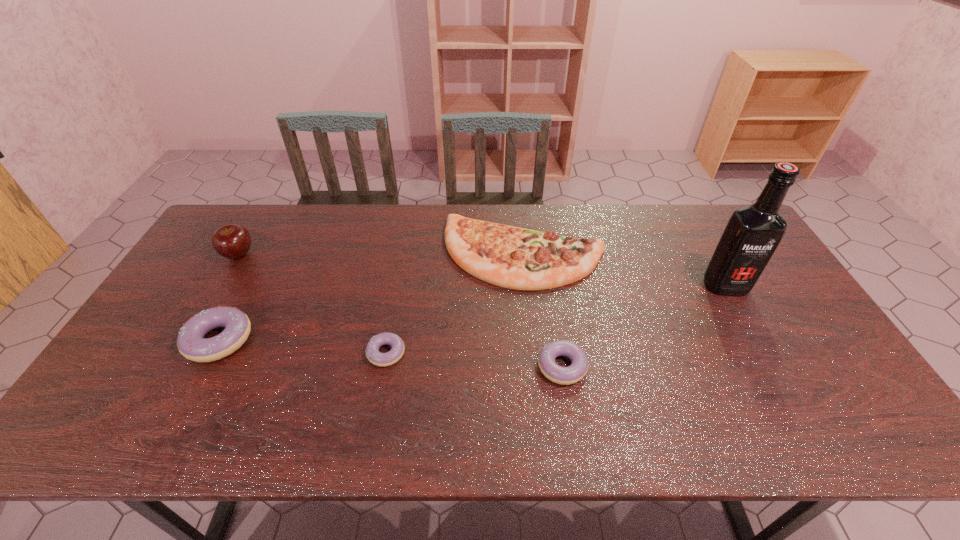
The width and height of the screenshot is (960, 540). Identify the location of object located in the right edge section of the desktop. (753, 232).

This screenshot has height=540, width=960. In order to click on object that is at the far left corner in this screenshot , I will do `click(232, 241)`.

Where is `vacant space at the far edge of the desktop`? The height and width of the screenshot is (540, 960). vacant space at the far edge of the desktop is located at coordinates (653, 209).

Where is `vacant space at the near edge of the desktop`? This screenshot has width=960, height=540. vacant space at the near edge of the desktop is located at coordinates (777, 375).

Find the location of a particular element. Image resolution: width=960 pixels, height=540 pixels. free space at the right edge of the desktop is located at coordinates (771, 285).

Find the location of `free space between the liquor and the tallest doughnut`. free space between the liquor and the tallest doughnut is located at coordinates (472, 313).

The width and height of the screenshot is (960, 540). I want to click on free point between the second tallest object and the shortest object, so click(312, 303).

The width and height of the screenshot is (960, 540). I want to click on empty space that is in between the tallest object and the shortest object, so click(556, 319).

At what (x,y) coordinates should I click in order to perform the action: click on unoccupied position between the fifth shortest object and the third object from left to right. Please return your answer as a coordinate pair (x, y). Image resolution: width=960 pixels, height=540 pixels. Looking at the image, I should click on (312, 303).

This screenshot has width=960, height=540. I want to click on free space between the second doughnut from left to right and the liquor, so click(556, 319).